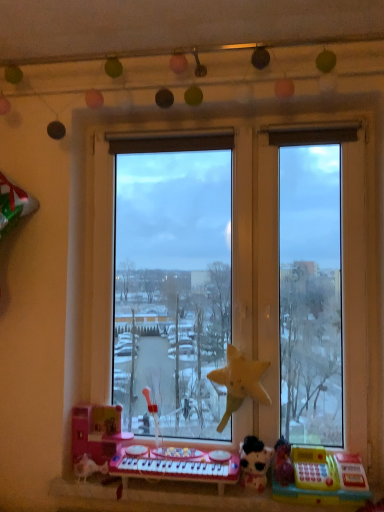
You are a GUI agent. You are given a task and a screenshot of the screen. Output one action in this format:
    pyautogui.click(x=<x>, y=<y>)
    Task: Click on the free space in front of white plush cat at lower right, which is counted as the third toy, starting from the left
    The height and width of the screenshot is (512, 384).
    Given the screenshot: What is the action you would take?
    pyautogui.click(x=264, y=500)